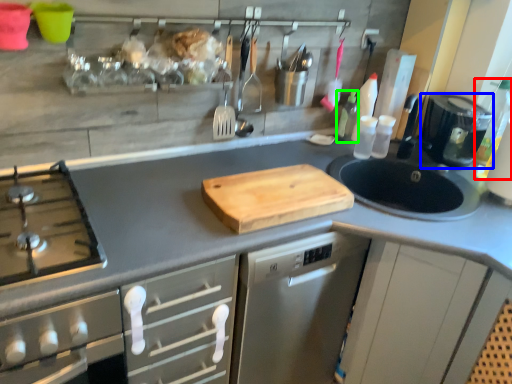
Question: Estimate the real-world distances between objects in this image. Which object is farther from bottle (highlighted by a red box), kitchen appliance (highlighted by a blue box) or bottle (highlighted by a green box)?

Choices:
 (A) kitchen appliance
 (B) bottle

Answer: (B)